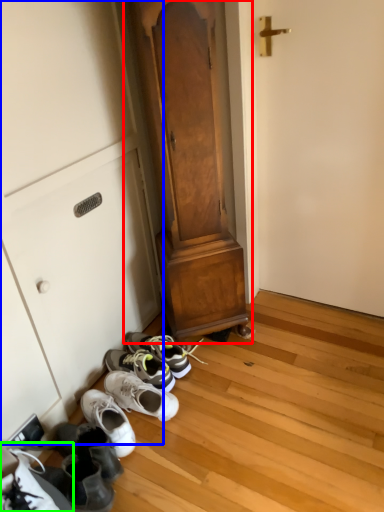
Question: Based on their relative distances, which object is farther from dresser (highlighted by a red box)? Choose from cabinetry (highlighted by a blue box) and footwear (highlighted by a green box).

Choices:
 (A) cabinetry
 (B) footwear

Answer: (B)